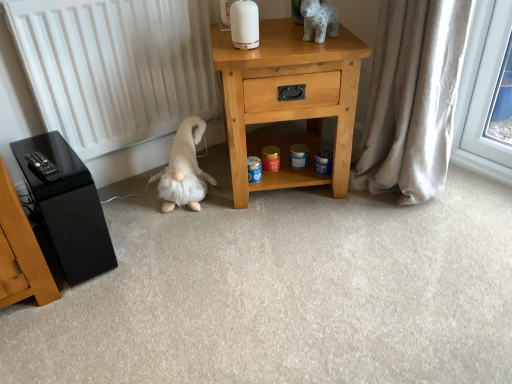
Describe the element at coordinates (288, 101) in the screenshot. I see `light wood nightstand at center` at that location.

This screenshot has height=384, width=512. What are the coordinates of `white glossy ceramic dog at upper center, which appears as the 1th animal when viewed from the top` in the screenshot? It's located at (319, 19).

Describe the element at coordinates (184, 169) in the screenshot. This screenshot has width=512, height=384. I see `fluffy white plush at lower left, arranged as the 1th animal when viewed from the left` at that location.

Identify the location of white matte radiator at left. 115,67.

What do you see at coordinates (68, 208) in the screenshot?
I see `black glossy speaker at left` at bounding box center [68, 208].

The height and width of the screenshot is (384, 512). Find the location of `black glossy speaker at left`. black glossy speaker at left is located at coordinates (68, 208).

Identify the location of light wood nightstand at center. The height and width of the screenshot is (384, 512). (288, 101).

From the picture: Is black glossy speaker at left at the back of light wood nightstand at center?

light wood nightstand at center does not have its back to black glossy speaker at left.

Could black glossy speaker at left be considered to be inside light wood nightstand at center?

That's incorrect, black glossy speaker at left is not inside light wood nightstand at center.

Is light wood nightstand at center bigger or smaller than black glossy speaker at left?

In the image, light wood nightstand at center appears to be larger than black glossy speaker at left.

From a real-world perspective, which object stands above the other?

light wood nightstand at center.

Is white matte radiator at left oriented away from white glossy ceramic dog at upper center, which appears as the 1th animal when viewed from the top?

white matte radiator at left is not turned away from white glossy ceramic dog at upper center, which appears as the 1th animal when viewed from the top.

Is white matte radiator at left positioned far away from white glossy ceramic dog at upper center, the 2th animal when ordered from bottom to top?

No, white matte radiator at left is not far away from white glossy ceramic dog at upper center, the 2th animal when ordered from bottom to top.

In the scene shown: Based on their sizes in the image, would you say white matte radiator at left is bigger or smaller than white glossy ceramic dog at upper center, which appears as the 1th animal when viewed from the top?

Considering their sizes, white matte radiator at left takes up more space than white glossy ceramic dog at upper center, which appears as the 1th animal when viewed from the top.

Could you measure the distance between white matte radiator at left and white glossy ceramic dog at upper center, which appears as the 1th animal when viewed from the top?

white matte radiator at left and white glossy ceramic dog at upper center, which appears as the 1th animal when viewed from the top, are 26.86 inches apart.

From the image's perspective, is light wood nightstand at center over white glossy ceramic dog at upper center, placed as the 2th animal when sorted from back to front?

No.

Could white glossy ceramic dog at upper center, the 2th animal in the left-to-right sequence, be considered to be inside light wood nightstand at center?

No, light wood nightstand at center does not contain white glossy ceramic dog at upper center, the 2th animal in the left-to-right sequence.

Who is shorter, light wood nightstand at center or white glossy ceramic dog at upper center, the 2th animal in the left-to-right sequence?

white glossy ceramic dog at upper center, the 2th animal in the left-to-right sequence, is shorter.

In the scene shown: Does light wood nightstand at center have a greater height compared to beige fabric curtain at right?

No.

Is beige fabric curtain at right at the back of light wood nightstand at center?

That's not correct — light wood nightstand at center is not looking away from beige fabric curtain at right.

Is light wood nightstand at center situated inside beige fabric curtain at right or outside?

light wood nightstand at center is outside beige fabric curtain at right.

Which object is more forward, light wood nightstand at center or beige fabric curtain at right?

beige fabric curtain at right is in front.

From a real-world perspective, is light wood nightstand at center located beneath fluffy white plush at lower left, which ranks as the 1th animal in bottom-to-top order?

No.

Is light wood nightstand at center facing away from fluffy white plush at lower left, which ranks as the 1th animal in back-to-front order?

No, light wood nightstand at center's orientation is not away from fluffy white plush at lower left, which ranks as the 1th animal in back-to-front order.

Considering the sizes of light wood nightstand at center and fluffy white plush at lower left, arranged as the 1th animal when viewed from the left, in the image, is light wood nightstand at center bigger or smaller than fluffy white plush at lower left, arranged as the 1th animal when viewed from the left,?

Considering their sizes, light wood nightstand at center takes up more space than fluffy white plush at lower left, arranged as the 1th animal when viewed from the left.

Considering the relative positions of light wood nightstand at center and fluffy white plush at lower left, which ranks as the 1th animal in bottom-to-top order, in the image provided, is light wood nightstand at center in front of fluffy white plush at lower left, which ranks as the 1th animal in bottom-to-top order,?

Yes, the depth of light wood nightstand at center is less than that of fluffy white plush at lower left, which ranks as the 1th animal in bottom-to-top order.

Would you say white glossy ceramic dog at upper center, placed as the first animal when sorted from front to back, is outside white matte radiator at left?

Yes, white glossy ceramic dog at upper center, placed as the first animal when sorted from front to back, is outside of white matte radiator at left.

Which of these two, white glossy ceramic dog at upper center, the 2th animal in the left-to-right sequence, or white matte radiator at left, is thinner?

white matte radiator at left.

Is white glossy ceramic dog at upper center, placed as the 2th animal when sorted from back to front, touching white matte radiator at left?

white glossy ceramic dog at upper center, placed as the 2th animal when sorted from back to front, and white matte radiator at left are clearly separated.

Is white glossy ceramic dog at upper center, the 2th animal when ordered from bottom to top, looking in the opposite direction of white matte radiator at left?

No, white glossy ceramic dog at upper center, the 2th animal when ordered from bottom to top, is not facing away from white matte radiator at left.

From a real-world perspective, does beige fabric curtain at right stand above light wood nightstand at center?

Yes, from a real-world perspective, beige fabric curtain at right is above light wood nightstand at center.

Locate an element on the screen. The width and height of the screenshot is (512, 384). nightstand located behind the beige fabric curtain at right is located at coordinates (288, 101).

From the image's perspective, which one is positioned lower, beige fabric curtain at right or light wood nightstand at center?

From the image's view, beige fabric curtain at right is below.

Is beige fabric curtain at right facing away from light wood nightstand at center?

No.

The image size is (512, 384). Identify the location of nightstand above the black glossy speaker at left (from the image's perspective). [x=288, y=101].

The width and height of the screenshot is (512, 384). Identify the location of radiator lying below the white glossy ceramic dog at upper center, placed as the first animal when sorted from front to back (from the image's perspective). (115, 67).

Looking at the image, which one is located further to beige fabric curtain at right, fluffy white plush at lower left, placed as the second animal when sorted from right to left, or light wood nightstand at center?

fluffy white plush at lower left, placed as the second animal when sorted from right to left, lies further to beige fabric curtain at right than the other object.

Which object lies nearer to the anchor point fluffy white plush at lower left, which ranks as the 1th animal in bottom-to-top order, light wood nightstand at center or white glossy ceramic dog at upper center, the 1th animal viewed from the right?

The object closer to fluffy white plush at lower left, which ranks as the 1th animal in bottom-to-top order, is light wood nightstand at center.

From the image, which object appears to be farther from beige fabric curtain at right, light wood nightstand at center or black glossy speaker at left?

black glossy speaker at left.

Based on their spatial positions, is fluffy white plush at lower left, placed as the second animal when sorted from right to left, or black glossy speaker at left closer to white glossy ceramic dog at upper center, which appears as the 1th animal when viewed from the top?

fluffy white plush at lower left, placed as the second animal when sorted from right to left.

Considering their positions, is light wood nightstand at center positioned closer to white glossy ceramic dog at upper center, the 1th animal viewed from the right, than fluffy white plush at lower left, positioned as the second animal in front-to-back order?

Based on the image, light wood nightstand at center appears to be nearer to white glossy ceramic dog at upper center, the 1th animal viewed from the right.

From the image, which object appears to be nearer to beige fabric curtain at right, light wood nightstand at center or fluffy white plush at lower left, which ranks as the 1th animal in back-to-front order?

Among the two, light wood nightstand at center is located nearer to beige fabric curtain at right.

From the image, which object appears to be farther from fluffy white plush at lower left, arranged as the 1th animal when viewed from the left, black glossy speaker at left or light wood nightstand at center?

black glossy speaker at left.

From the image, which object appears to be nearer to white glossy ceramic dog at upper center, which appears as the 1th animal when viewed from the top, fluffy white plush at lower left, arranged as the 1th animal when viewed from the left, or beige fabric curtain at right?

The object closer to white glossy ceramic dog at upper center, which appears as the 1th animal when viewed from the top, is beige fabric curtain at right.

Find the location of a particular element. The width and height of the screenshot is (512, 384). radiator situated between black glossy speaker at left and light wood nightstand at center from left to right is located at coordinates (115, 67).

Identify the location of nightstand located between black glossy speaker at left and beige fabric curtain at right in the left-right direction. (288, 101).

The image size is (512, 384). Identify the location of animal located between black glossy speaker at left and light wood nightstand at center in the left-right direction. (184, 169).

Where is `animal between light wood nightstand at center and beige fabric curtain at right in the horizontal direction`? animal between light wood nightstand at center and beige fabric curtain at right in the horizontal direction is located at coordinates (319, 19).